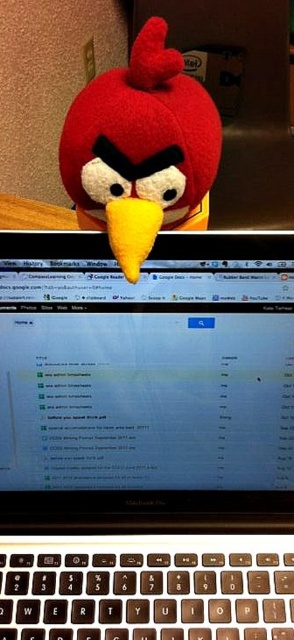
Question: Does black plastic laptop at upper center have a lesser width compared to matte plush bird at center?

Choices:
 (A) yes
 (B) no

Answer: (B)

Question: Can you confirm if black plastic laptop at upper center is wider than matte plush bird at center?

Choices:
 (A) yes
 (B) no

Answer: (A)

Question: Does black plastic laptop at upper center appear on the right side of matte plush bird at center?

Choices:
 (A) yes
 (B) no

Answer: (B)

Question: Which object appears closest to the camera in this image?

Choices:
 (A) matte plush bird at center
 (B) black plastic laptop at upper center

Answer: (A)

Question: Which object is farther from the camera taking this photo?

Choices:
 (A) black plastic laptop at upper center
 (B) matte plush bird at center

Answer: (A)